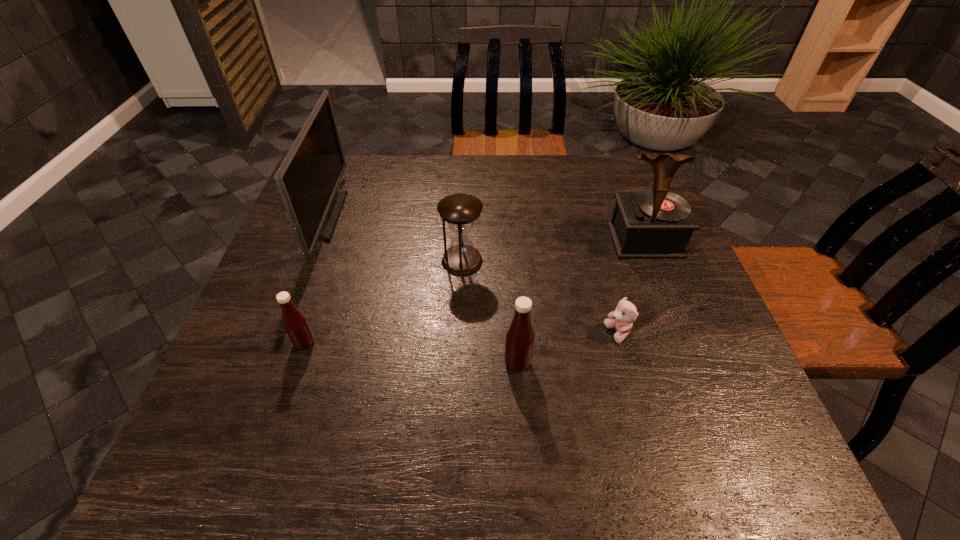
The image size is (960, 540). I want to click on object that ranks as the fourth closest to the left Tabasco sauce, so click(621, 319).

Image resolution: width=960 pixels, height=540 pixels. Identify the location of vacant space that satisfies the following two spatial constraints: 1. on the screen side of the monitor; 2. on the left side of the nearest object. (267, 363).

Where is `vacant area that satisfies the following two spatial constraints: 1. on the front side of the right Tabasco sauce; 2. on the left side of the third object from left to right`? This screenshot has width=960, height=540. vacant area that satisfies the following two spatial constraints: 1. on the front side of the right Tabasco sauce; 2. on the left side of the third object from left to right is located at coordinates (458, 363).

Identify the location of free space that satisfies the following two spatial constraints: 1. at the face of the shortest object; 2. on the front side of the right Tabasco sauce. (626, 363).

Identify the location of free region that satisfies the following two spatial constraints: 1. on the back side of the left Tabasco sauce; 2. on the screen side of the monitor. The height and width of the screenshot is (540, 960). [347, 217].

The height and width of the screenshot is (540, 960). Identify the location of free space that satisfies the following two spatial constraints: 1. at the horn opening of the rightmost object; 2. at the face of the teddy bear. (681, 334).

You are a GUI agent. You are given a task and a screenshot of the screen. Output one action in this format:
    pyautogui.click(x=<x>, y=<y>)
    Task: Click on the free space in the image that satisfies the following two spatial constraints: 1. on the screen side of the third object from left to right; 2. on the left side of the monitor
    Image resolution: width=960 pixels, height=540 pixels.
    Given the screenshot: What is the action you would take?
    pyautogui.click(x=307, y=261)

The height and width of the screenshot is (540, 960). Find the location of `free space that satisfies the following two spatial constraints: 1. on the screen side of the shorter Tabasco sauce; 2. on the right side of the monitor`. free space that satisfies the following two spatial constraints: 1. on the screen side of the shorter Tabasco sauce; 2. on the right side of the monitor is located at coordinates coord(275,343).